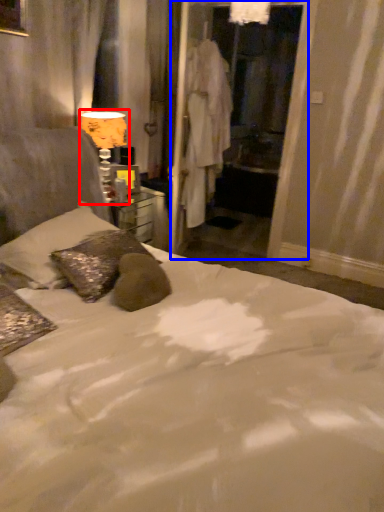
Question: Which object is further to the camera taking this photo, table lamp (highlighted by a red box) or screen door (highlighted by a blue box)?

Choices:
 (A) table lamp
 (B) screen door

Answer: (B)